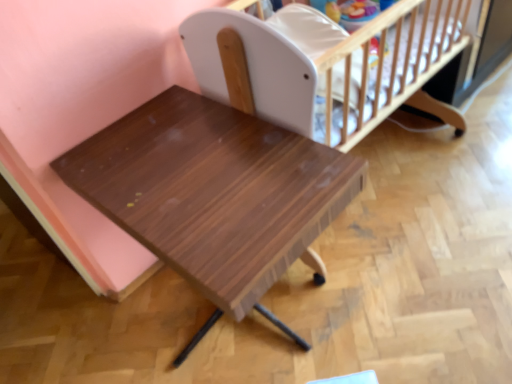
Question: Is white matte infant bed at upper center inside wooden table at center?

Choices:
 (A) no
 (B) yes

Answer: (A)

Question: From a real-world perspective, is wooden table at center over white matte infant bed at upper center?

Choices:
 (A) yes
 (B) no

Answer: (B)

Question: Is wooden table at center further to the viewer compared to white matte infant bed at upper center?

Choices:
 (A) yes
 (B) no

Answer: (B)

Question: Considering the relative sizes of wooden table at center and white matte infant bed at upper center in the image provided, is wooden table at center shorter than white matte infant bed at upper center?

Choices:
 (A) yes
 (B) no

Answer: (B)

Question: Could you tell me if wooden table at center is turned towards white matte infant bed at upper center?

Choices:
 (A) no
 (B) yes

Answer: (A)

Question: Is wooden table at center thinner than white matte infant bed at upper center?

Choices:
 (A) no
 (B) yes

Answer: (A)

Question: From a real-world perspective, is white matte infant bed at upper center beneath wooden table at center?

Choices:
 (A) no
 (B) yes

Answer: (A)

Question: Could wooden table at center be considered to be inside white matte infant bed at upper center?

Choices:
 (A) yes
 (B) no

Answer: (B)

Question: Can you confirm if white matte infant bed at upper center is shorter than wooden table at center?

Choices:
 (A) no
 (B) yes

Answer: (B)

Question: From the image's perspective, is white matte infant bed at upper center below wooden table at center?

Choices:
 (A) yes
 (B) no

Answer: (B)

Question: Can you confirm if white matte infant bed at upper center is taller than wooden table at center?

Choices:
 (A) no
 (B) yes

Answer: (A)

Question: Is white matte infant bed at upper center thinner than wooden table at center?

Choices:
 (A) yes
 (B) no

Answer: (A)

Question: Considering the positions of point (367, 76) and point (259, 188), is point (367, 76) closer or farther from the camera than point (259, 188)?

Choices:
 (A) farther
 (B) closer

Answer: (A)